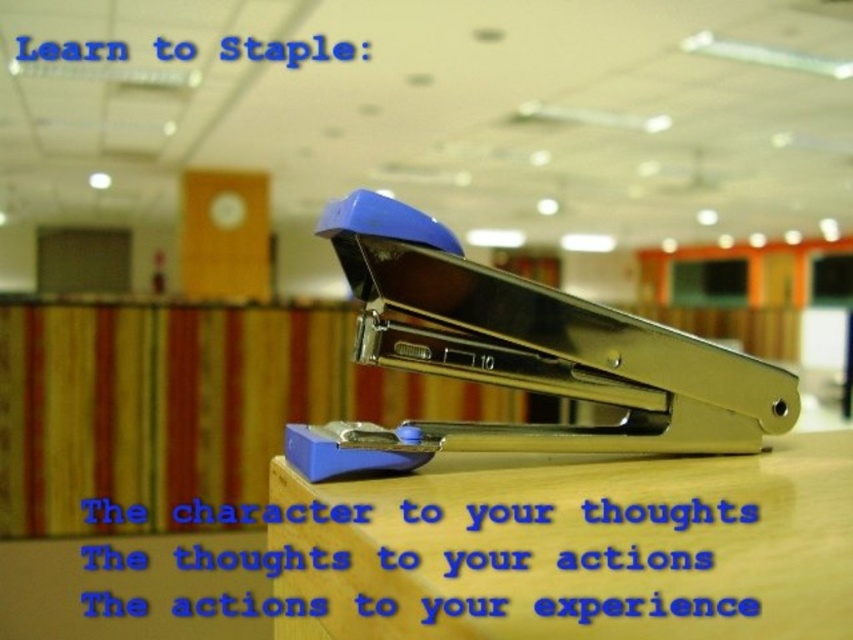
Does point (360, 481) come in front of point (347, 264)?

Yes, it is.

Can you confirm if wooden table at center is taller than blue metallic stapler at center?

No.

Find the location of a particular element. This screenshot has height=640, width=853. wooden table at center is located at coordinates (577, 547).

Where is `wooden table at center`? wooden table at center is located at coordinates (577, 547).